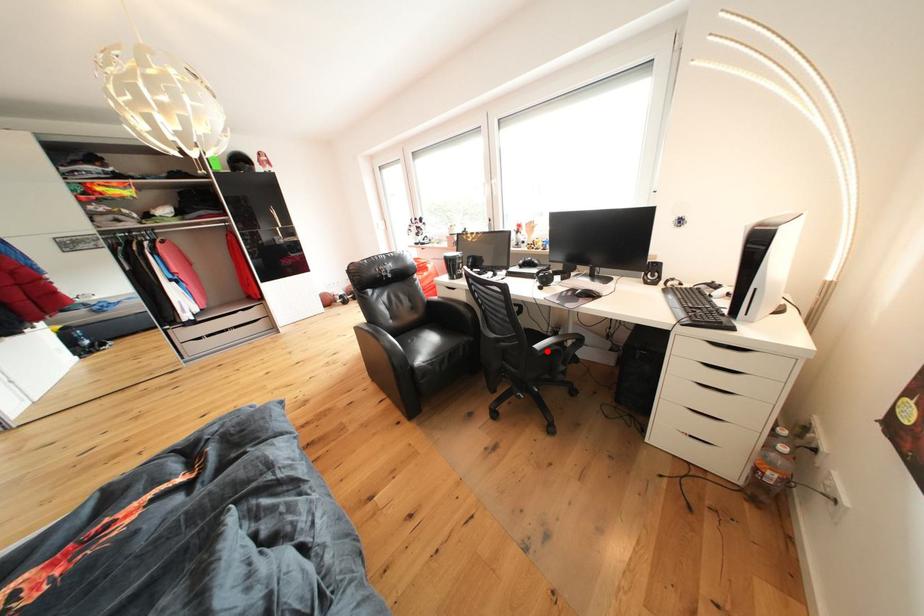
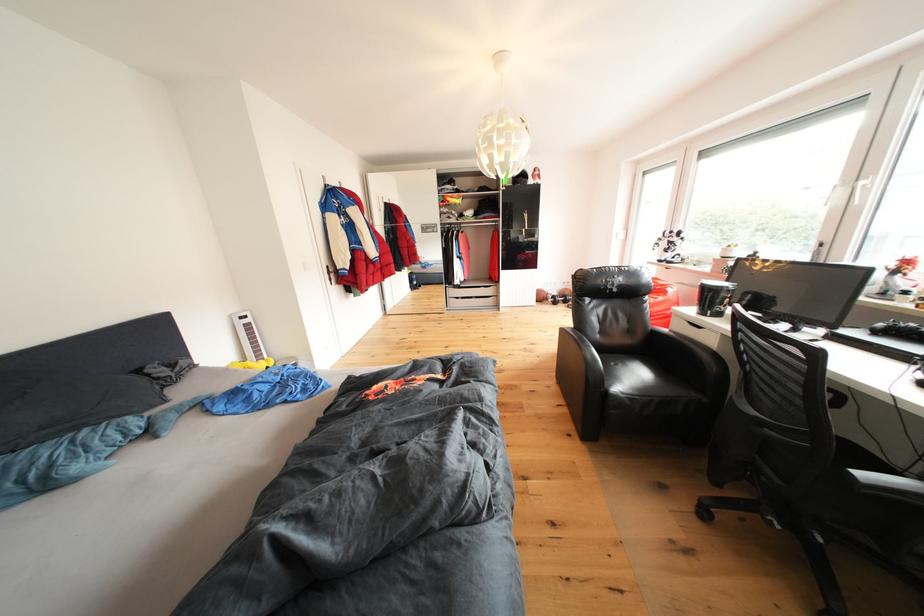
Question: A red point is marked in image1. In image2, is the corresponding 3D point closer to the camera or farther? Reply with the corresponding letter.

Choices:
 (A) The corresponding 3D point is closer.
 (B) The corresponding 3D point is farther.

Answer: (A)